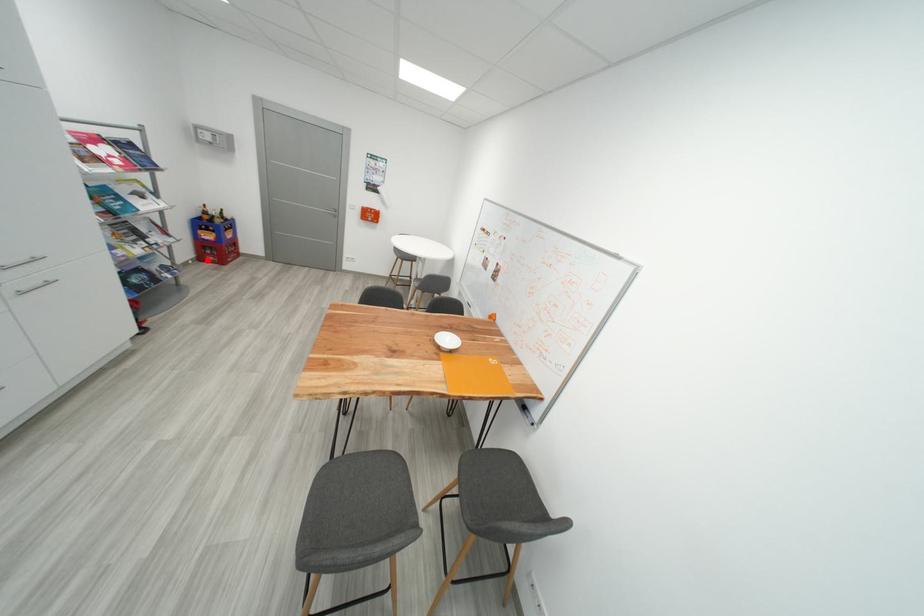
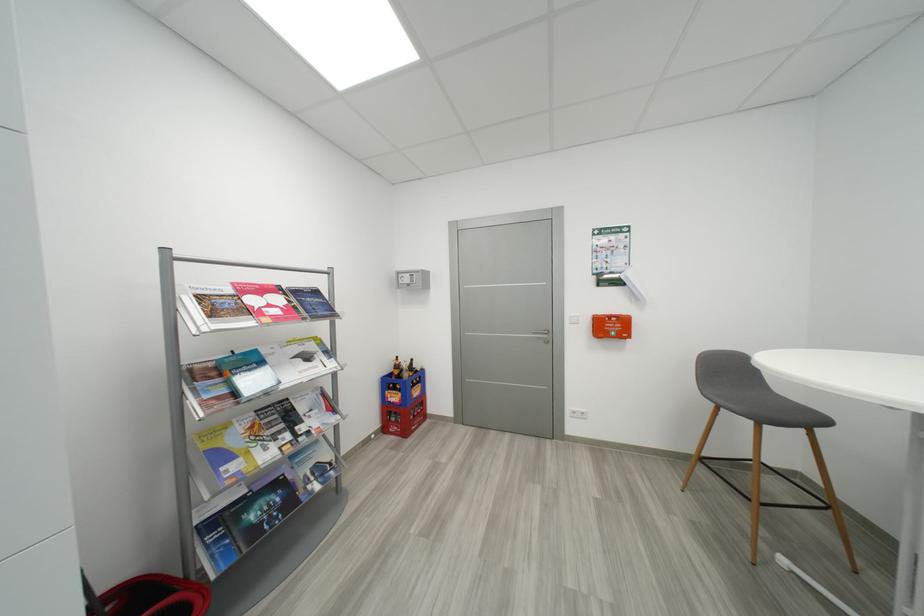
Question: I am providing you with two images of the same scene from different viewpoints. Given a red point in image1, look at the same physical point in image2. Is it:

Choices:
 (A) Closer to the viewpoint
 (B) Farther from the viewpoint

Answer: (B)